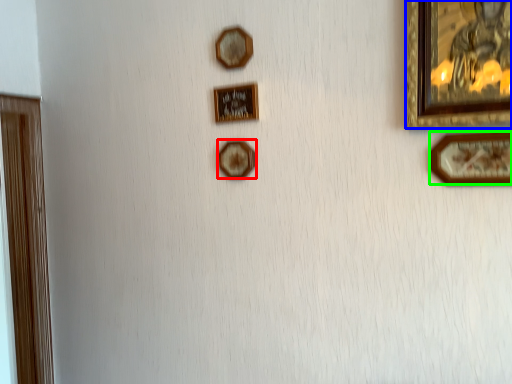
Question: Which object is positioned closest to picture frame (highlighted by a red box)? Select from picture frame (highlighted by a blue box) and picture frame (highlighted by a green box).

Choices:
 (A) picture frame
 (B) picture frame

Answer: (B)